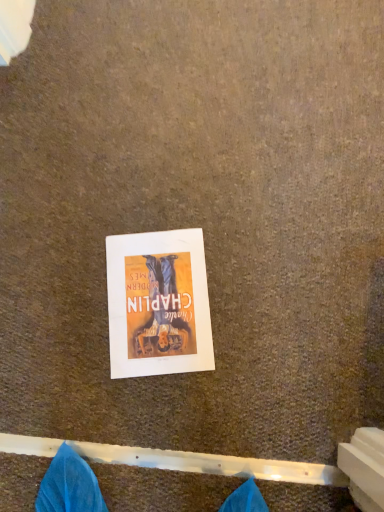
Locate an element on the screen. Image resolution: width=384 pixels, height=512 pixels. empty space that is ontop of matte paper poster at center (from a real-world perspective) is located at coordinates (157, 304).